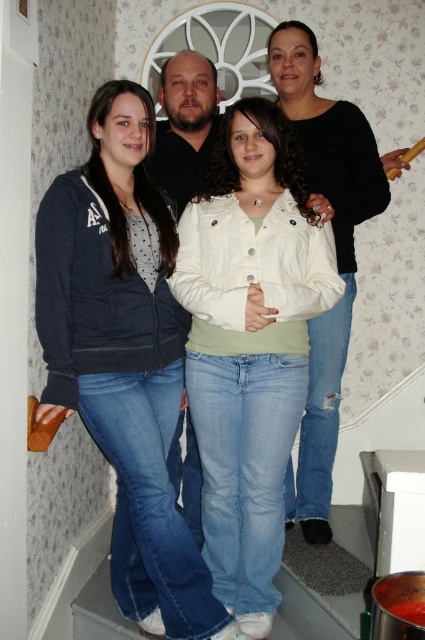
You are standing in the hallway and see the white matte jacket at center. If you want to reach it without moving your feet, can you do it?

The white matte jacket at center is 6.02 feet away from viewer, so you cannot reach it without moving your feet since it is farther than an average person can reach.

Based on the scene description, where is the white matte jacket at center located in relation to the other individuals and the white door with a decorative circular window?

The white matte jacket at center is located at point coordinates of (249, 342), which is centrally positioned in the image between the individuals and near the white door with a decorative circular window.